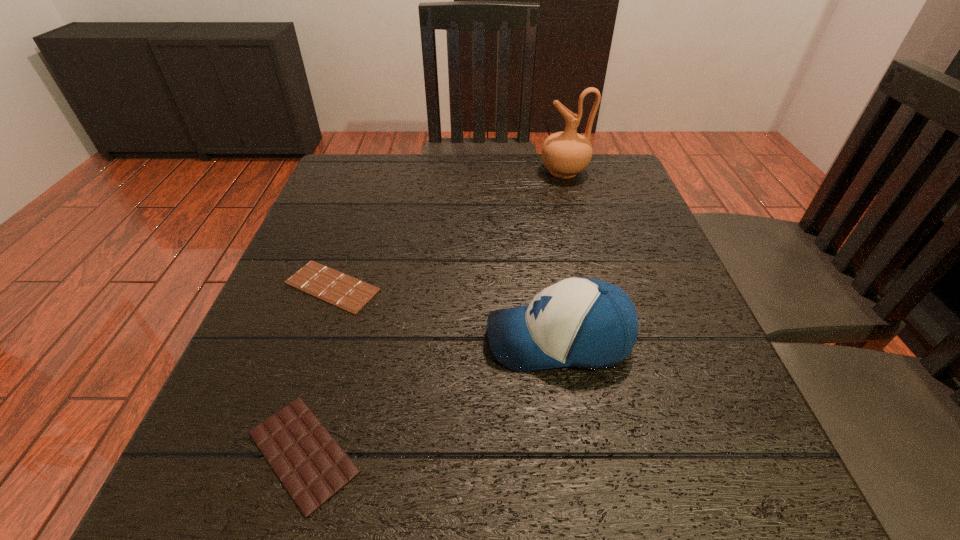
I want to click on vacant space that satisfies the following two spatial constraints: 1. on the spout of the pottery; 2. on the front side of the nearer chocolate bar, so click(641, 452).